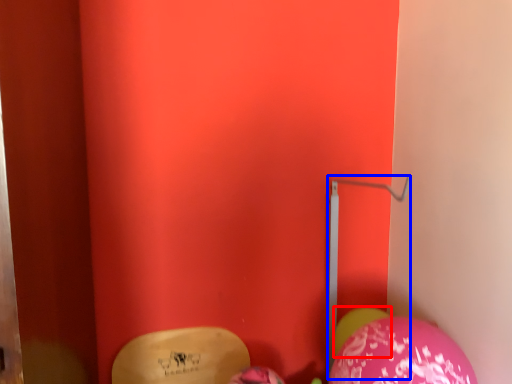
Question: Which object is closer to the camera taking this photo, balloon (highlighted by a red box) or trim (highlighted by a blue box)?

Choices:
 (A) balloon
 (B) trim

Answer: (B)